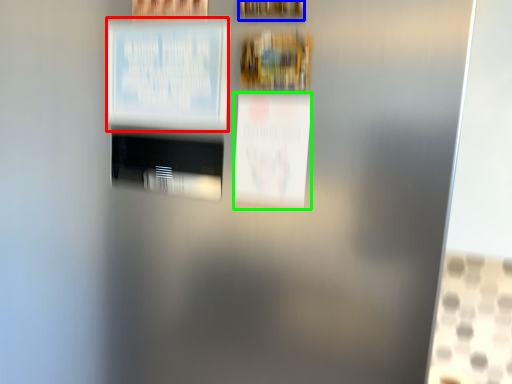
Question: Considering the real-world distances, which object is closest to poster (highlighted by a red box)? picture frame (highlighted by a blue box) or poster (highlighted by a green box).

Choices:
 (A) picture frame
 (B) poster

Answer: (B)